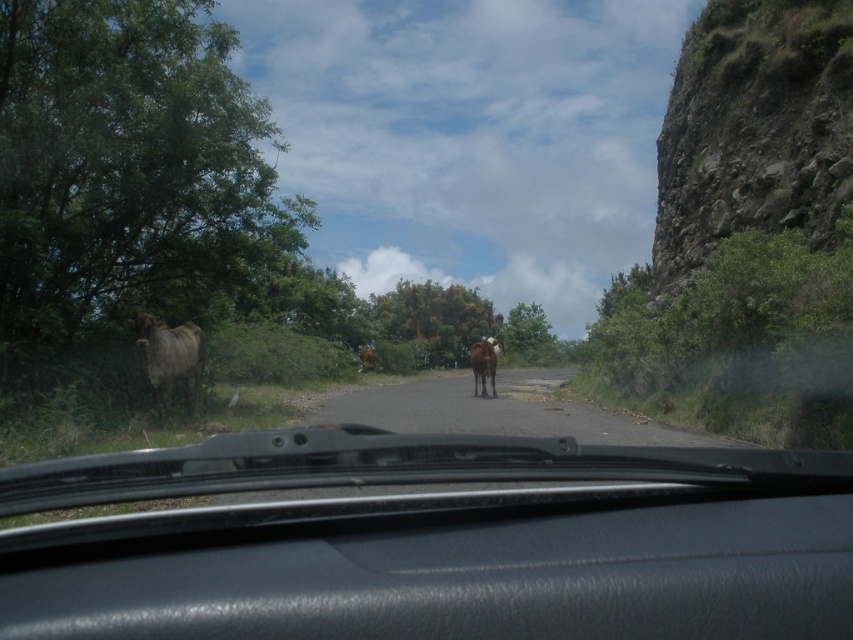
Based on the photo, you are driving a car and want to check if the black matte windshield wipers at center are positioned to the left or right side of the brown dirt road at center. Based on the scene, which direction are the windshield wipers located relative to the road?

The black matte windshield wipers at center are positioned to the left of the brown dirt road at center.

You are a passenger in a car driving along the brown dirt road at center. You notice the brown glossy cow at center ahead on the road. From your perspective inside the car, which side of the road is the cow located on?

The brown glossy cow at center is on the right side of the road because the brown dirt road at center is positioned on the left side of the cow.

You are driving a car and need to pass two cows on the road. The brown matte bull at left is partially hidden by plants, and the brown glossy cow at center is walking away from you. Considering their sizes in the image, which cow takes up more visual space in the scene?

The brown glossy cow at center takes up more visual space in the scene because it occupies more space than the brown matte bull at left according to the description.